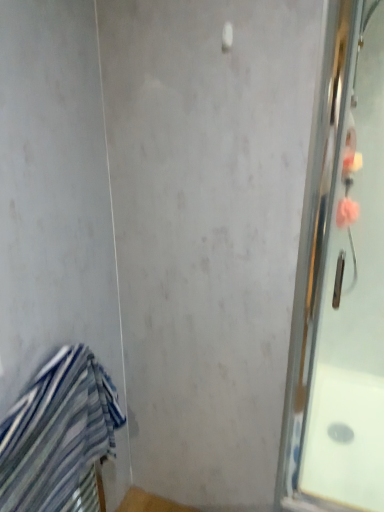
Question: Should I look upward or downward to see clear glass shower door at right?

Choices:
 (A) down
 (B) up

Answer: (A)

Question: Can you confirm if blue striped towel at lower left is wider than clear glass shower door at right?

Choices:
 (A) yes
 (B) no

Answer: (A)

Question: Is blue striped towel at lower left turned away from clear glass shower door at right?

Choices:
 (A) no
 (B) yes

Answer: (A)

Question: Considering the relative positions of blue striped towel at lower left and clear glass shower door at right in the image provided, is blue striped towel at lower left to the left of clear glass shower door at right from the viewer's perspective?

Choices:
 (A) yes
 (B) no

Answer: (A)

Question: Does blue striped towel at lower left have a lesser height compared to clear glass shower door at right?

Choices:
 (A) no
 (B) yes

Answer: (B)

Question: Considering the relative positions of blue striped towel at lower left and clear glass shower door at right in the image provided, is blue striped towel at lower left to the right of clear glass shower door at right from the viewer's perspective?

Choices:
 (A) yes
 (B) no

Answer: (B)

Question: Does blue striped towel at lower left have a lesser width compared to clear glass shower door at right?

Choices:
 (A) yes
 (B) no

Answer: (B)

Question: From a real-world perspective, is clear glass shower door at right located beneath blue striped towel at lower left?

Choices:
 (A) yes
 (B) no

Answer: (B)

Question: Does clear glass shower door at right turn towards blue striped towel at lower left?

Choices:
 (A) no
 (B) yes

Answer: (A)

Question: From the image's perspective, is clear glass shower door at right on top of blue striped towel at lower left?

Choices:
 (A) no
 (B) yes

Answer: (B)

Question: Is blue striped towel at lower left completely or partially inside clear glass shower door at right?

Choices:
 (A) yes
 (B) no

Answer: (B)

Question: Is clear glass shower door at right next to blue striped towel at lower left and touching it?

Choices:
 (A) no
 (B) yes

Answer: (A)

Question: From a real-world perspective, is clear glass shower door at right located higher than blue striped towel at lower left?

Choices:
 (A) yes
 (B) no

Answer: (A)

Question: Is blue striped towel at lower left bigger or smaller than clear glass shower door at right?

Choices:
 (A) big
 (B) small

Answer: (A)